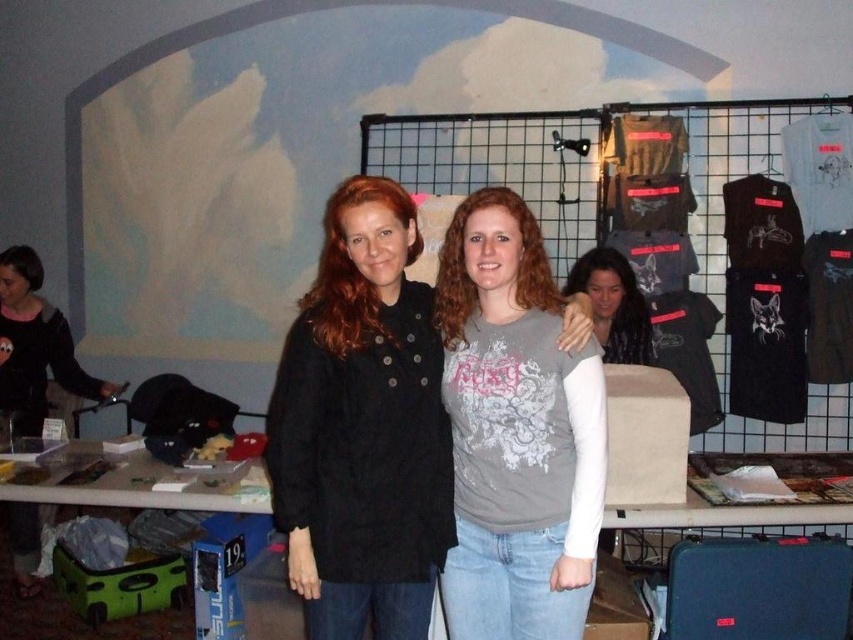
Question: Which point is closer to the camera taking this photo?

Choices:
 (A) (341, 516)
 (B) (607, 301)
 (C) (20, 332)

Answer: (A)

Question: Which of the following is the closest to the observer?

Choices:
 (A) (380, 483)
 (B) (49, 355)
 (C) (596, 260)
 (D) (519, 520)

Answer: (A)

Question: In this image, where is gray matte shirt at center located relative to black matte jacket at left?

Choices:
 (A) below
 (B) above

Answer: (A)

Question: Does matte black jacket at center have a greater width compared to black matte jacket at left?

Choices:
 (A) yes
 (B) no

Answer: (A)

Question: Is the position of matte black jacket at center more distant than that of gray matte shirt at center?

Choices:
 (A) yes
 (B) no

Answer: (A)

Question: Which of these objects is positioned farthest from the black matte jacket at left?

Choices:
 (A) matte black jacket at center
 (B) gray matte shirt at center
 (C) matte gray shirt at center

Answer: (B)